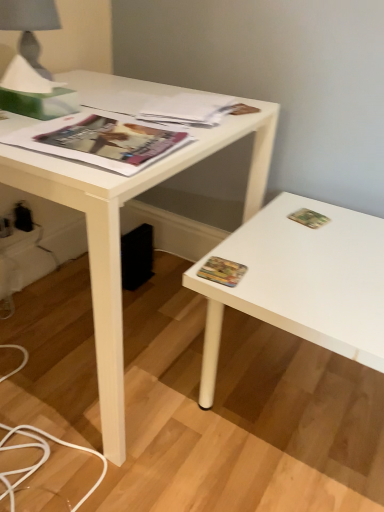
The width and height of the screenshot is (384, 512). In order to click on free spot above matte paper magazine at upper center, the 1th magazine viewed from the back (from a real-world perspective) in this screenshot , I will do `click(198, 98)`.